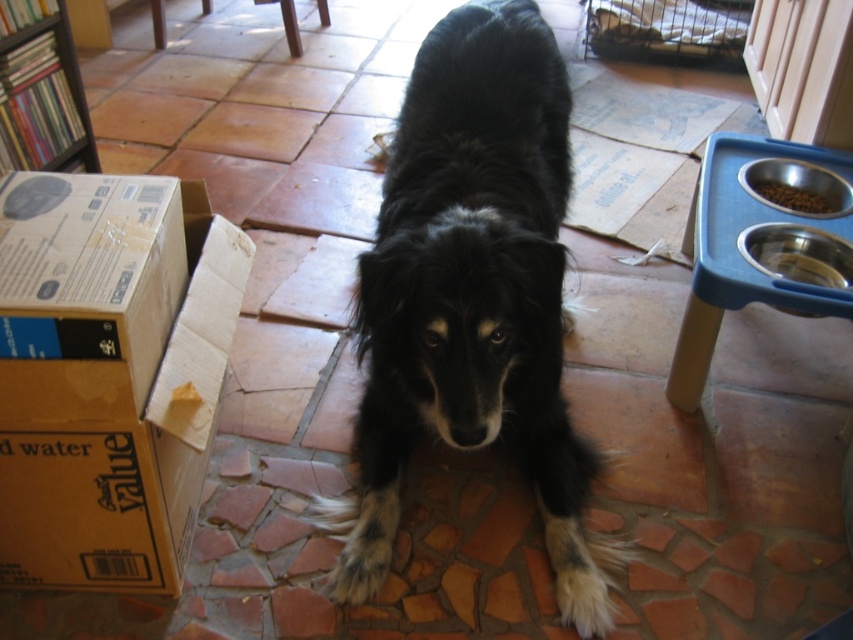
You are a dog owner who wants to ensure your black fur dog at center has easy access to its blue plastic pet feeder at right. Given that the dog can comfortably reach up to 60 centimeters, can it comfortably reach the feeder?

The black fur dog at center and blue plastic pet feeder at right are 57.72 centimeters apart from each other, which is within the dog s 60 centimeter reach. Therefore, the dog can comfortably reach the feeder.